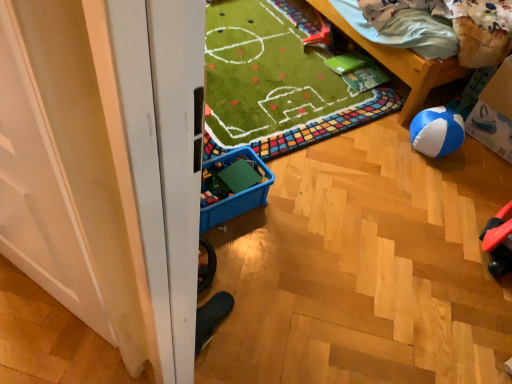
Question: Is there a large distance between cardboard box at right and rubberized plastic toy at upper center?

Choices:
 (A) no
 (B) yes

Answer: (B)

Question: Is rubberized plastic toy at upper center located within cardboard box at right?

Choices:
 (A) no
 (B) yes

Answer: (A)

Question: Is cardboard box at right outside of rubberized plastic toy at upper center?

Choices:
 (A) no
 (B) yes

Answer: (B)

Question: Is cardboard box at right to the right of rubberized plastic toy at upper center from the viewer's perspective?

Choices:
 (A) no
 (B) yes

Answer: (B)

Question: Considering the relative sizes of cardboard box at right and rubberized plastic toy at upper center in the image provided, is cardboard box at right smaller than rubberized plastic toy at upper center?

Choices:
 (A) yes
 (B) no

Answer: (B)

Question: Is the depth of cardboard box at right less than that of rubberized plastic toy at upper center?

Choices:
 (A) no
 (B) yes

Answer: (B)

Question: From a real-world perspective, is blue plastic storage box at center physically below rubberized plastic toy at upper center?

Choices:
 (A) no
 (B) yes

Answer: (A)

Question: From the image's perspective, is blue plastic storage box at center under rubberized plastic toy at upper center?

Choices:
 (A) no
 (B) yes

Answer: (B)

Question: Is blue plastic storage box at center aimed at rubberized plastic toy at upper center?

Choices:
 (A) yes
 (B) no

Answer: (B)

Question: Is blue plastic storage box at center placed right next to rubberized plastic toy at upper center?

Choices:
 (A) no
 (B) yes

Answer: (A)

Question: From the image's perspective, is blue plastic storage box at center over rubberized plastic toy at upper center?

Choices:
 (A) no
 (B) yes

Answer: (A)

Question: Is the depth of blue plastic storage box at center less than that of rubberized plastic toy at upper center?

Choices:
 (A) no
 (B) yes

Answer: (B)

Question: Does wooden bed at upper right have a lesser height compared to rubberized plastic toy at upper center?

Choices:
 (A) yes
 (B) no

Answer: (B)